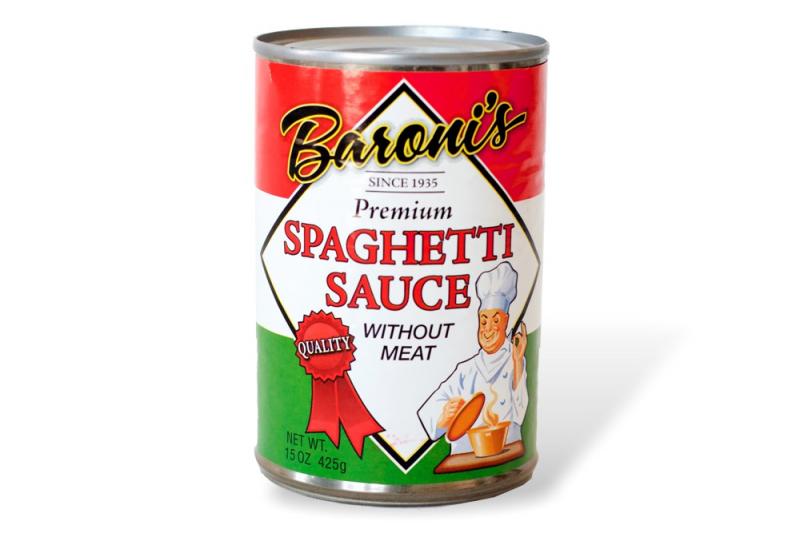
This screenshot has height=533, width=800. In order to click on can on stovetop in this screenshot , I will do `click(462, 460)`.